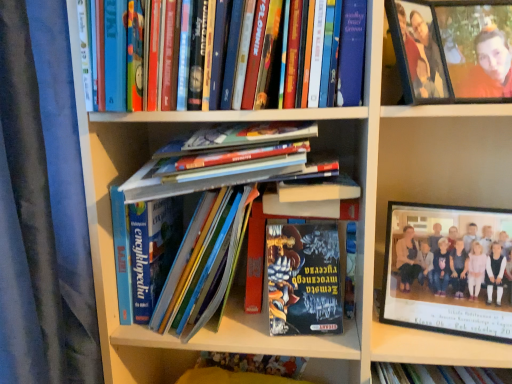
Identify the location of free spot above hardcover book at center, the 2th book from the top (from a real-world perspective). (229, 119).